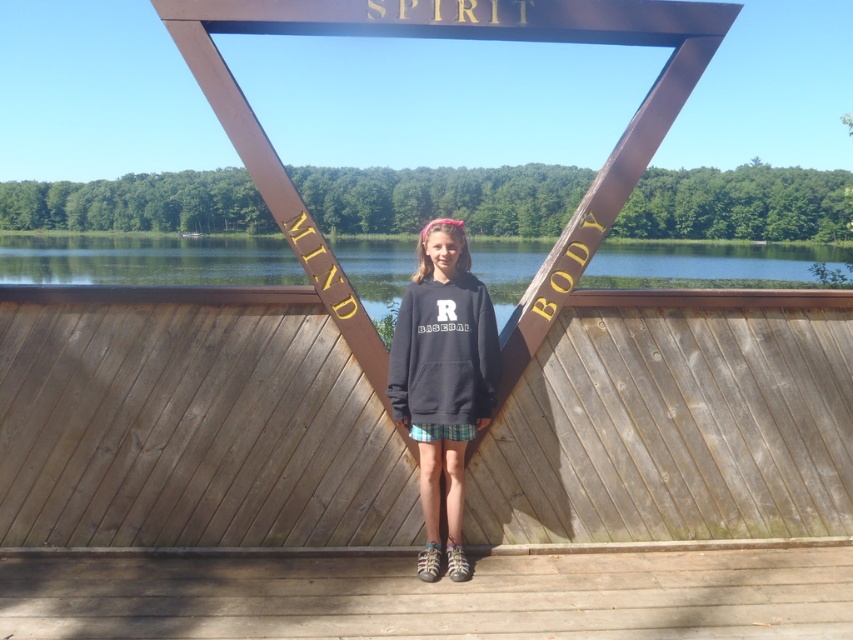
Does dark blue hoodie at center have a greater width compared to matte black sweatshirt at center?

In fact, dark blue hoodie at center might be narrower than matte black sweatshirt at center.

Which is below, dark blue hoodie at center or matte black sweatshirt at center?

dark blue hoodie at center is below.

Is point (488, 314) closer to camera compared to point (488, 385)?

No, (488, 314) is behind (488, 385).

I want to click on dark blue hoodie at center, so click(442, 380).

Is clear blue water at center positioned before dark blue hoodie at center?

That is False.

Measure the distance between clear blue water at center and dark blue hoodie at center.

A distance of 9.16 meters exists between clear blue water at center and dark blue hoodie at center.

Is point (404, 243) positioned in front of point (494, 385)?

No, (404, 243) is behind (494, 385).

Identify the location of clear blue water at center. This screenshot has width=853, height=640. (146, 259).

Is clear blue water at center taller than matte black sweatshirt at center?

Yes, clear blue water at center is taller than matte black sweatshirt at center.

This screenshot has height=640, width=853. What do you see at coordinates (146, 259) in the screenshot?
I see `clear blue water at center` at bounding box center [146, 259].

The height and width of the screenshot is (640, 853). What do you see at coordinates (146, 259) in the screenshot?
I see `clear blue water at center` at bounding box center [146, 259].

Image resolution: width=853 pixels, height=640 pixels. What are the coordinates of `clear blue water at center` in the screenshot? It's located at (146, 259).